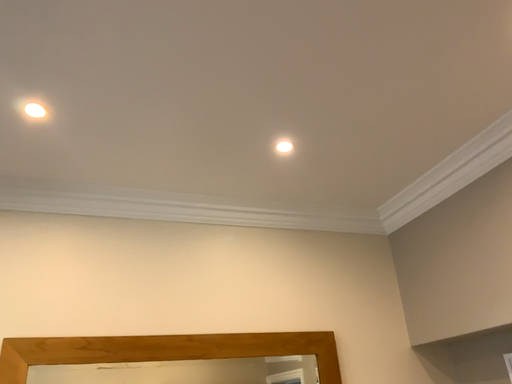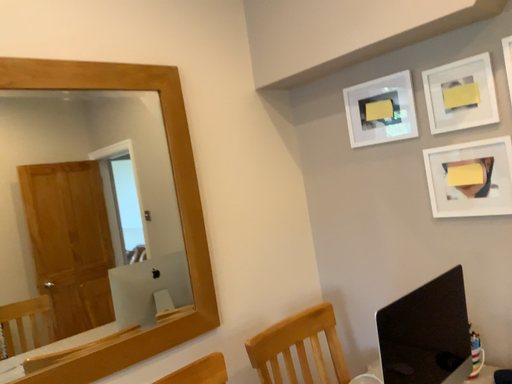
Question: How did the camera likely rotate when shooting the video?

Choices:
 (A) rotated upward
 (B) rotated downward

Answer: (B)